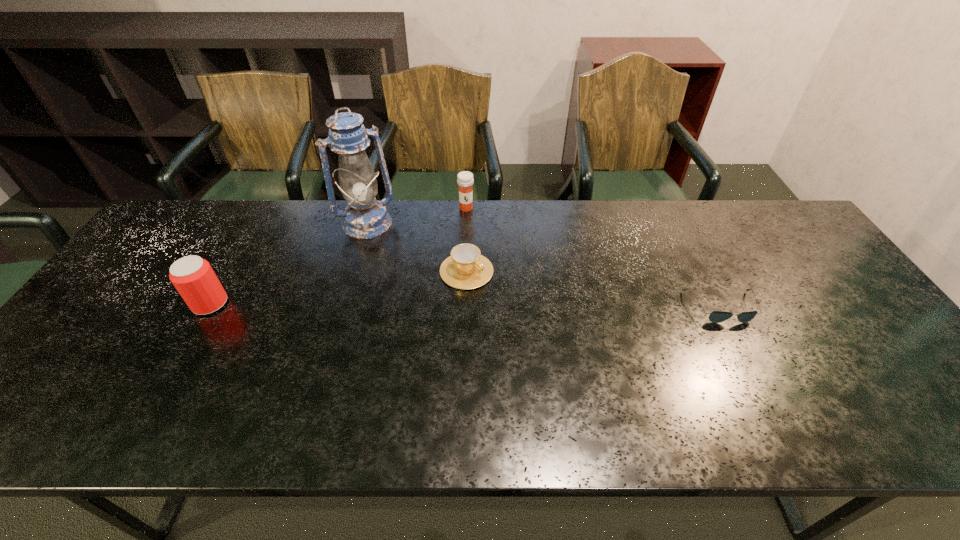
The height and width of the screenshot is (540, 960). I want to click on free space between the rightmost object and the medicine, so click(594, 258).

Where is `vacant space that's between the leftmost object and the sunglasses`? The height and width of the screenshot is (540, 960). vacant space that's between the leftmost object and the sunglasses is located at coordinates (466, 306).

The width and height of the screenshot is (960, 540). I want to click on free spot between the cup and the medicine, so click(x=467, y=240).

This screenshot has width=960, height=540. In order to click on unoccupied position between the second shortest object and the medicine in this screenshot , I will do `click(467, 240)`.

Where is `vacant area that lies between the leftmost object and the medicine`? This screenshot has width=960, height=540. vacant area that lies between the leftmost object and the medicine is located at coordinates (338, 256).

Identify the location of free spot between the medicine and the cup. This screenshot has height=540, width=960. (467, 240).

This screenshot has width=960, height=540. I want to click on free space between the rightmost object and the leftmost object, so click(466, 306).

Locate which object ranks in proximity to the medicine. Please provide its 2D coordinates. Your answer should be formatted as a tuple, i.e. [(x, y)], where the tuple contains the x and y coordinates of a point satisfying the conditions above.

[(466, 268)]

The width and height of the screenshot is (960, 540). Find the location of `object identified as the closest to the medicine`. object identified as the closest to the medicine is located at coordinates (466, 268).

I want to click on free space that satisfies the following two spatial constraints: 1. on the back side of the leftmost object; 2. on the right side of the fourth tallest object, so click(228, 271).